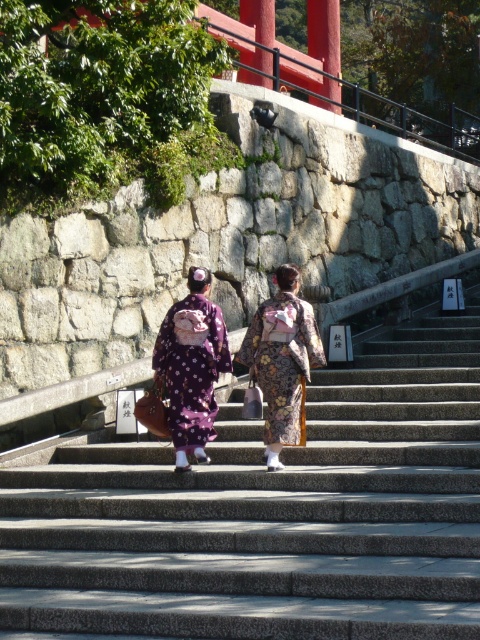
Does purple satin kimono at center have a greater height compared to floral kimono at center?

Incorrect, purple satin kimono at center's height is not larger of floral kimono at center's.

Can you confirm if purple satin kimono at center is wider than floral kimono at center?

No.

You are a GUI agent. You are given a task and a screenshot of the screen. Output one action in this format:
    pyautogui.click(x=<x>, y=<y>)
    Task: Click on the purple satin kimono at center
    Image resolution: width=480 pixels, height=640 pixels.
    Given the screenshot: What is the action you would take?
    pyautogui.click(x=192, y=365)

Identify the location of purple satin kimono at center. The height and width of the screenshot is (640, 480). (192, 365).

Which is more to the right, smooth stone stairs at center or floral kimono at center?

smooth stone stairs at center

Which is more to the left, smooth stone stairs at center or floral kimono at center?

floral kimono at center is more to the left.

Between point (410, 552) and point (322, 349), which one is positioned behind?

The point (322, 349) is more distant.

Identify the location of smooth stone stairs at center. [268, 516].

At what (x,y) coordinates should I click in order to perform the action: click on smooth stone stairs at center. Please return your answer as a coordinate pair (x, y). Looking at the image, I should click on (268, 516).

Describe the element at coordinates (268, 516) in the screenshot. The width and height of the screenshot is (480, 640). I see `smooth stone stairs at center` at that location.

This screenshot has width=480, height=640. What do you see at coordinates (268, 516) in the screenshot? I see `smooth stone stairs at center` at bounding box center [268, 516].

Where is `smooth stone stairs at center`? This screenshot has width=480, height=640. smooth stone stairs at center is located at coordinates (268, 516).